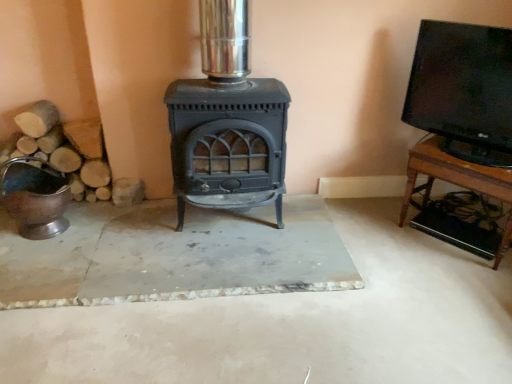
The height and width of the screenshot is (384, 512). I want to click on vacant space to the left of wooden tv stand at right, so click(382, 235).